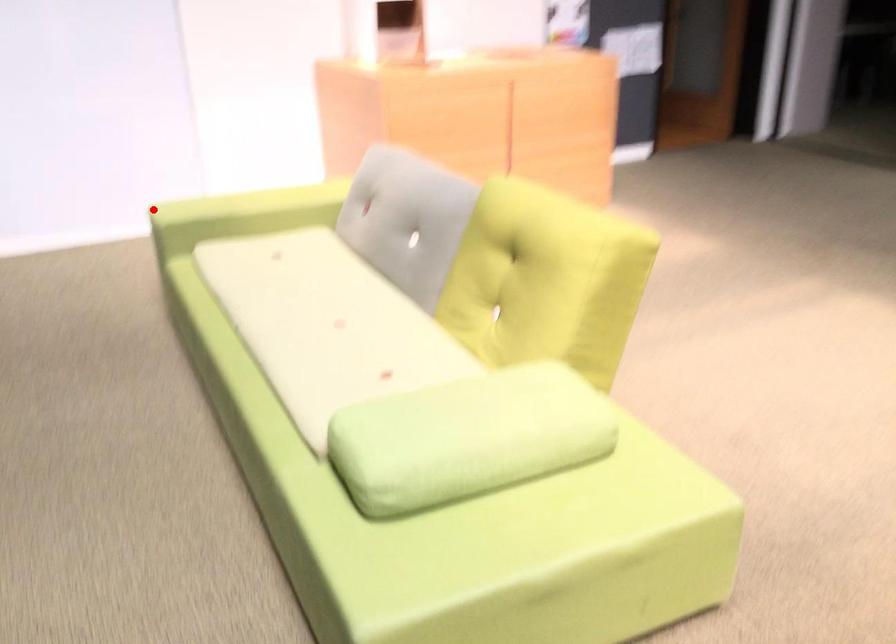
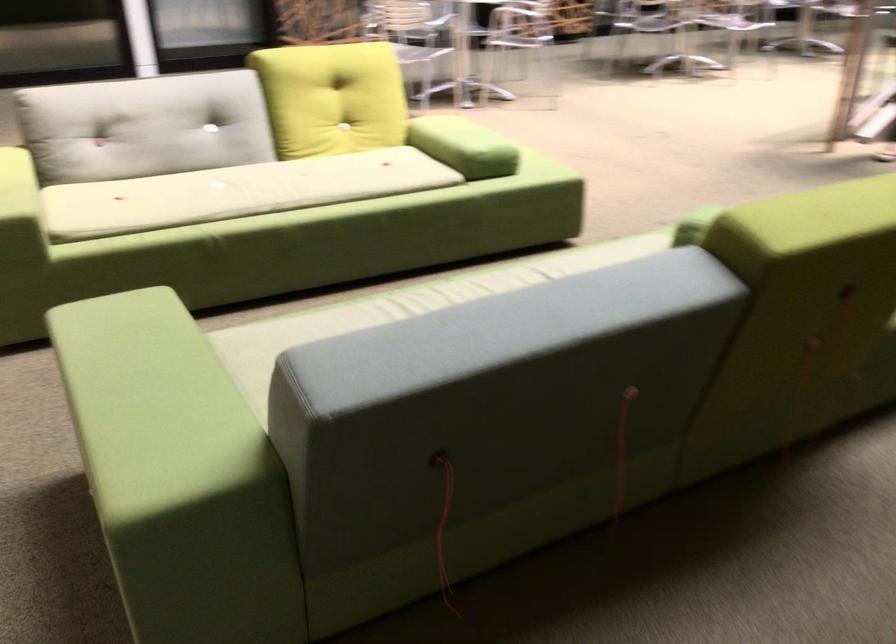
Question: I am providing you with two images of the same scene from different viewpoints. Image1 has a red point marked. In image2, the corresponding 3D location appears at what relative position? Reply with the corresponding letter.

Choices:
 (A) Closer
 (B) Farther

Answer: (A)